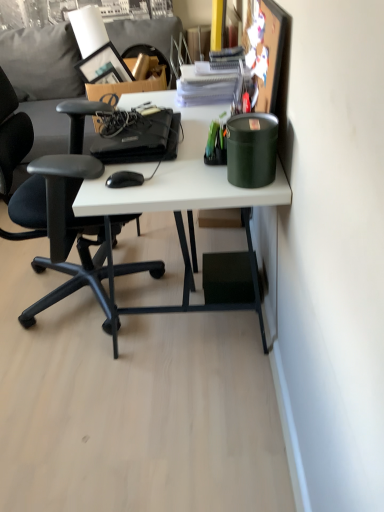
Find the location of a particular element. The height and width of the screenshot is (512, 384). vacant area that lies in front of white matte desk at center is located at coordinates (153, 426).